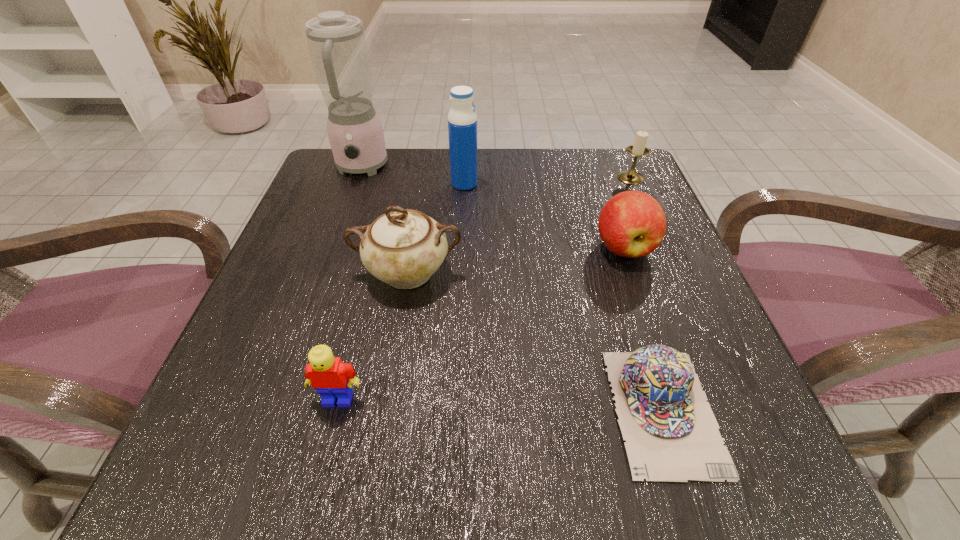
Locate an element on the screen. blank space located on the front of the candle holder is located at coordinates (654, 231).

At what (x,y) coordinates should I click in order to perform the action: click on vacant space located on the back of the apple. Please return your answer as a coordinate pair (x, y). Image resolution: width=960 pixels, height=540 pixels. Looking at the image, I should click on (591, 153).

Identify the location of blank space located 0.100m on the front-facing side of the Lego. The image size is (960, 540). (317, 484).

Locate an element on the screen. This screenshot has height=540, width=960. food processor that is at the far edge is located at coordinates (337, 45).

The width and height of the screenshot is (960, 540). I want to click on water bottle that is at the far edge, so click(462, 119).

Where is `candle holder positioned at the far edge`? The height and width of the screenshot is (540, 960). candle holder positioned at the far edge is located at coordinates (638, 149).

The height and width of the screenshot is (540, 960). What are the coordinates of `object at the near edge` in the screenshot? It's located at (671, 433).

Where is `food processor located in the left edge section of the desktop`? Image resolution: width=960 pixels, height=540 pixels. food processor located in the left edge section of the desktop is located at coordinates click(x=337, y=45).

The image size is (960, 540). In order to click on chinaware that is at the left edge in this screenshot , I will do `click(403, 248)`.

Find the location of a particular element. This screenshot has height=540, width=960. Lego that is at the left edge is located at coordinates (332, 379).